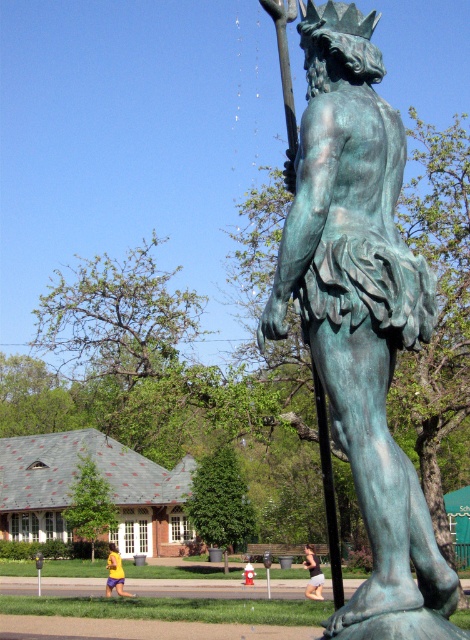
Question: Observing the image, what is the correct spatial positioning of green patina statue at center in reference to black metal pole at center?

Choices:
 (A) above
 (B) below

Answer: (A)

Question: In this image, where is black fabric shorts at lower center located relative to yellow fabric at lower left?

Choices:
 (A) left
 (B) right

Answer: (B)

Question: Considering the real-world distances, which object is closest to the black metal pole at center?

Choices:
 (A) black fabric shorts at lower center
 (B) green patina statue at center

Answer: (B)

Question: Can you confirm if green patina statue at center is smaller than yellow fabric at lower left?

Choices:
 (A) no
 (B) yes

Answer: (B)

Question: Which point is farther from the camera taking this photo?

Choices:
 (A) (329, 445)
 (B) (115, 582)
 (C) (393, 113)
 (D) (316, 561)

Answer: (D)

Question: Which of the following is the farthest from the observer?

Choices:
 (A) black metal pole at center
 (B) yellow fabric at lower left
 (C) black fabric shorts at lower center
 (D) green patina statue at center

Answer: (B)